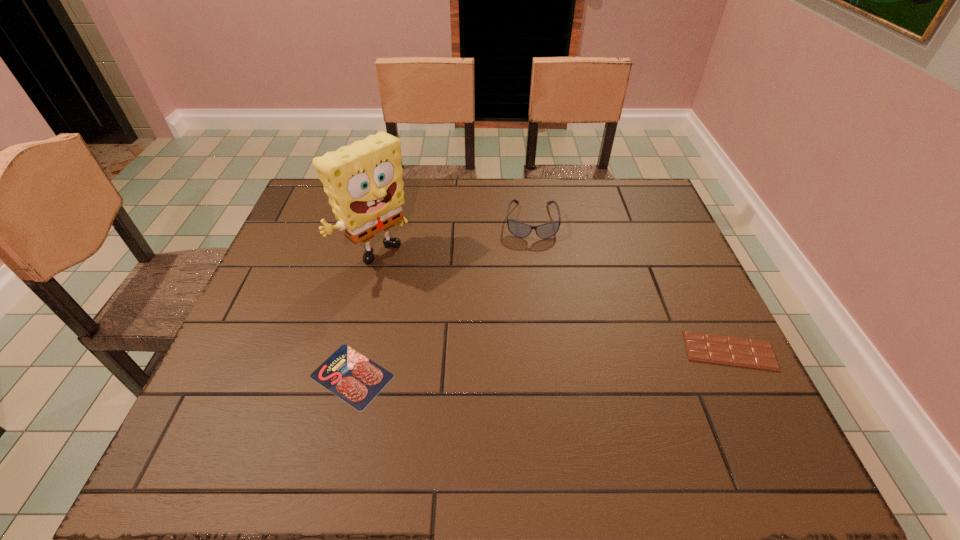
Find the location of a particular element. vacant spot on the desktop that is between the salami and the rightmost object and is positioned on the lenses of the second tallest object is located at coordinates (537, 363).

Find the location of `free spot on the desktop that is between the salami and the rightmost object and is positioned on the face of the tallest object`. free spot on the desktop that is between the salami and the rightmost object and is positioned on the face of the tallest object is located at coordinates (511, 366).